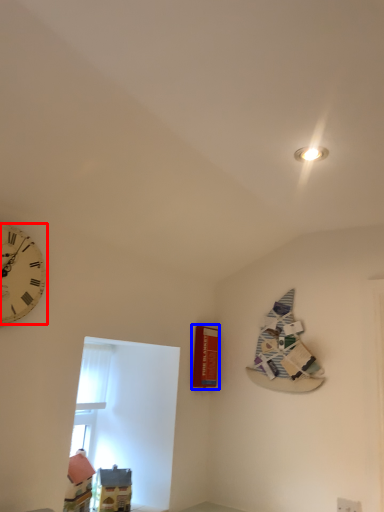
Question: Which of the following is the farthest to the observer, wall clock (highlighted by a red box) or magazine (highlighted by a blue box)?

Choices:
 (A) wall clock
 (B) magazine

Answer: (B)